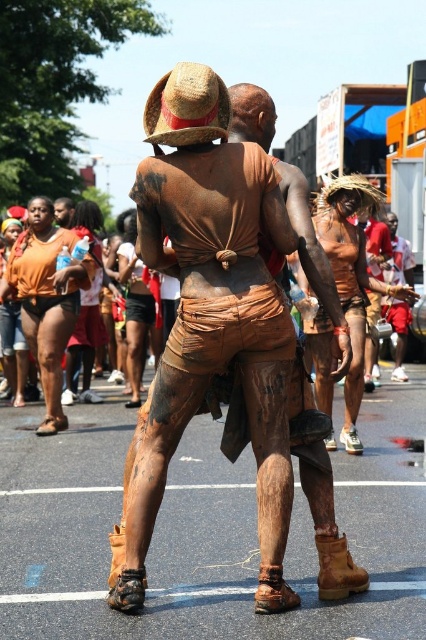
Does point (232, 259) come closer to viewer compared to point (157, 152)?

Yes, point (232, 259) is closer to viewer.

Is matte brown mud at center to the left of straw hat at upper center from the viewer's perspective?

In fact, matte brown mud at center is to the right of straw hat at upper center.

What do you see at coordinates (212, 316) in the screenshot? I see `matte brown mud at center` at bounding box center [212, 316].

Locate an element on the screen. matte brown mud at center is located at coordinates (212, 316).